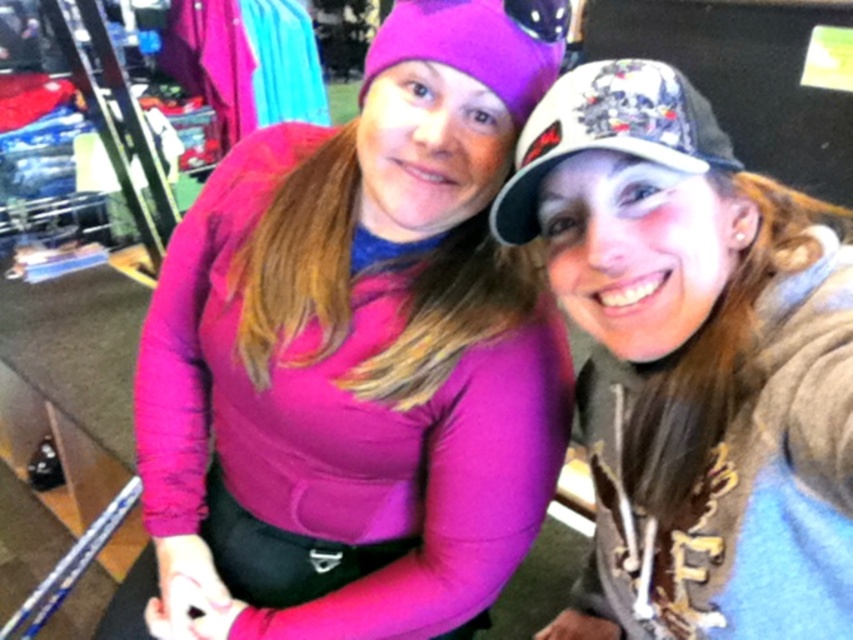
How much distance is there between matte pink sweater at center and white textured cap at upper right?

The distance of matte pink sweater at center from white textured cap at upper right is 8.16 inches.

The width and height of the screenshot is (853, 640). What do you see at coordinates (357, 356) in the screenshot? I see `matte pink sweater at center` at bounding box center [357, 356].

Where is `matte pink sweater at center`? matte pink sweater at center is located at coordinates (357, 356).